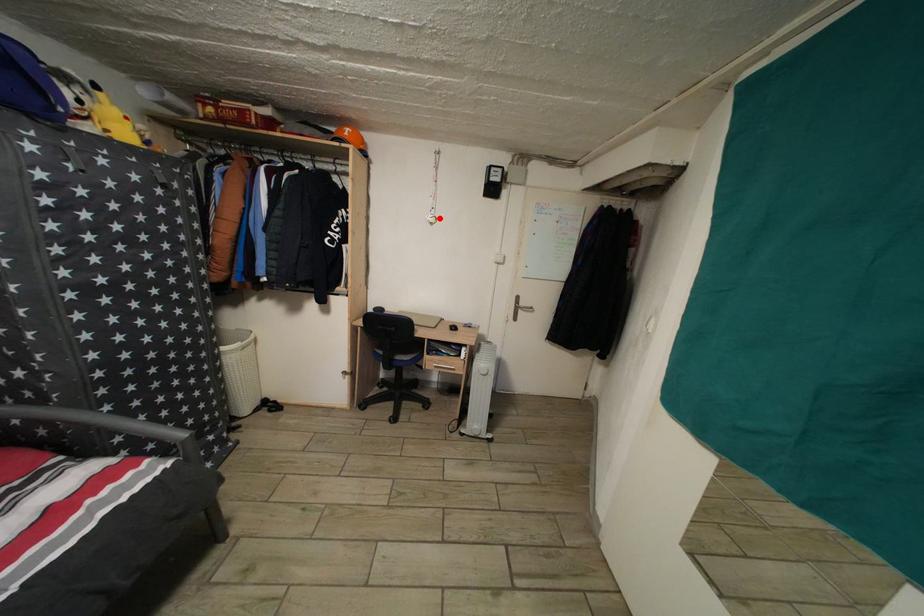
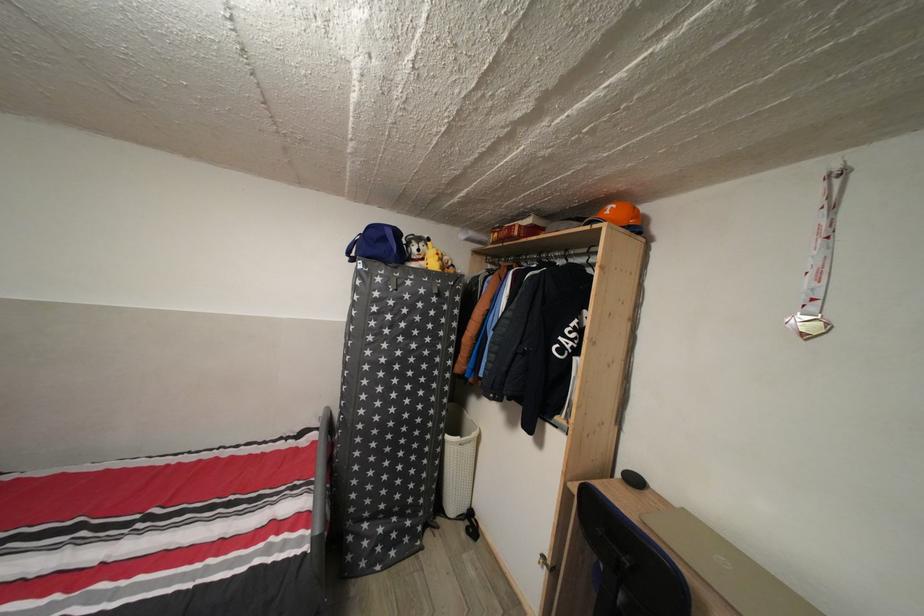
Question: I am providing you with two images of the same scene from different viewpoints. In image1, a red point is highlighted. Considering the same 3D point in image2, which of the following is correct?

Choices:
 (A) It is closer
 (B) It is farther

Answer: (B)